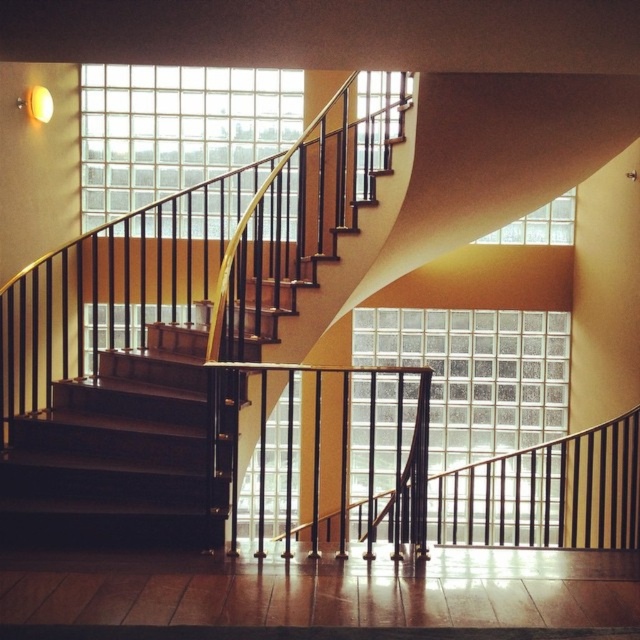
Question: Which of the following is the farthest from the observer?

Choices:
 (A) (131, 468)
 (B) (106, 172)
 (C) (445, 464)
 (D) (570, 193)

Answer: (C)

Question: Does dark brown wooden stairs at lower left appear on the right side of clear glass wall at center?

Choices:
 (A) no
 (B) yes

Answer: (A)

Question: Which of the following is the closest to the observer?

Choices:
 (A) (438, 442)
 (B) (129, 433)

Answer: (B)

Question: Is clear glass wall at upper center smaller than clear glass block wall at upper center?

Choices:
 (A) no
 (B) yes

Answer: (A)

Question: Does dark brown wooden stairs at lower left have a greater width compared to clear glass wall at center?

Choices:
 (A) yes
 (B) no

Answer: (B)

Question: Which object is farther from the camera taking this photo?

Choices:
 (A) clear glass wall at upper center
 (B) dark brown wooden stairs at lower left

Answer: (A)